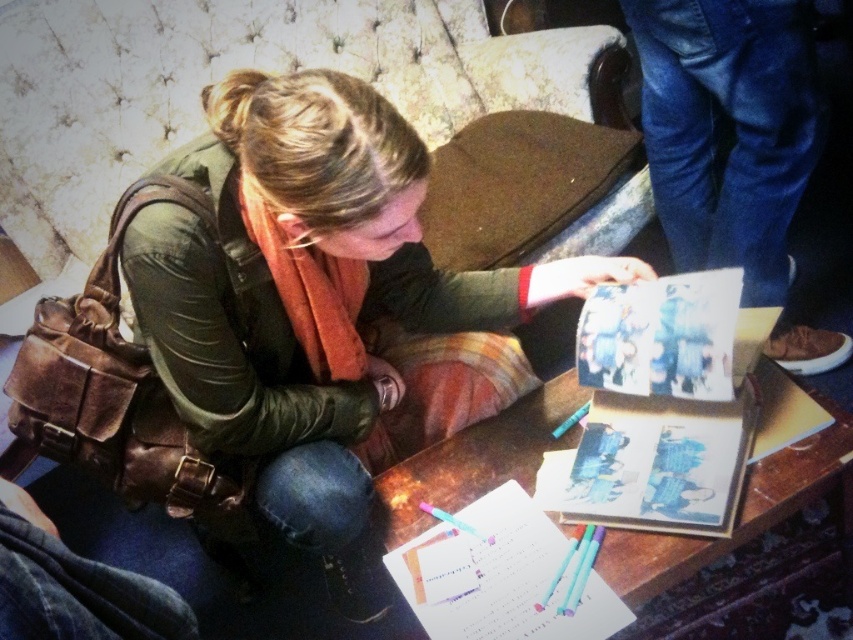
Which is more to the right, matte green jacket at center or wooden table at center?

Positioned to the right is wooden table at center.

Between matte green jacket at center and wooden table at center, which one has less height?

Standing shorter between the two is wooden table at center.

Locate an element on the screen. matte green jacket at center is located at coordinates (315, 301).